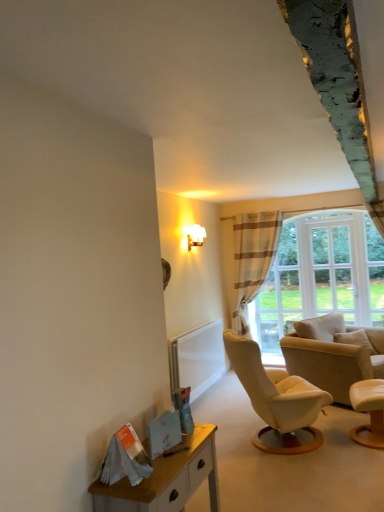
Find the location of `beige leather chair at right, arranged as the 2th chair when viewed from the front`. beige leather chair at right, arranged as the 2th chair when viewed from the front is located at coordinates (334, 354).

Locate an element on the screen. white frosted glass wall sconce at upper center is located at coordinates (195, 236).

What do you see at coordinates (166, 479) in the screenshot?
I see `wooden desk at lower left` at bounding box center [166, 479].

What are the coordinates of `beige leather chair at right, arranged as the 2th chair when viewed from the front` in the screenshot? It's located at (334, 354).

In terms of width, does wooden desk at lower left look wider or thinner when compared to striped fabric curtain at center?

Clearly, wooden desk at lower left has less width compared to striped fabric curtain at center.

Is wooden desk at lower left smaller than striped fabric curtain at center?

Yes.

In the scene shown: Is striped fabric curtain at center at the back of wooden desk at lower left?

No.

Is wooden desk at lower left next to striped fabric curtain at center?

wooden desk at lower left and striped fabric curtain at center are clearly separated.

Which object is closer to the camera, striped fabric curtain at center or wooden desk at lower left?

wooden desk at lower left is closer to the camera.

Between point (258, 272) and point (194, 459), which one is positioned behind?

Point (258, 272)

Do you think striped fabric curtain at center is within wooden desk at lower left, or outside of it?

striped fabric curtain at center lies outside wooden desk at lower left.

Can you tell me how much striped fabric curtain at center and wooden desk at lower left differ in facing direction?

89.7 degrees separate the facing orientations of striped fabric curtain at center and wooden desk at lower left.

Where is `lamp above the smooth beige armchair at lower right, placed as the 2th chair when sorted from back to front (from a real-world perspective)`? This screenshot has height=512, width=384. lamp above the smooth beige armchair at lower right, placed as the 2th chair when sorted from back to front (from a real-world perspective) is located at coordinates (195, 236).

From the image's perspective, is white frosted glass wall sconce at upper center under smooth beige armchair at lower right, placed as the 2th chair when sorted from back to front?

Actually, white frosted glass wall sconce at upper center appears above smooth beige armchair at lower right, placed as the 2th chair when sorted from back to front, in the image.

From a real-world perspective, is white frosted glass wall sconce at upper center over smooth beige armchair at lower right, placed as the 2th chair when sorted from back to front?

Yes, from a real-world perspective, white frosted glass wall sconce at upper center is above smooth beige armchair at lower right, placed as the 2th chair when sorted from back to front.

Is white glass window at upper right wider than beige leather chair at right, the first chair in the back-to-front sequence?

No, white glass window at upper right is not wider than beige leather chair at right, the first chair in the back-to-front sequence.

Is white glass window at upper right bigger than beige leather chair at right, arranged as the 2th chair when viewed from the front?

Actually, white glass window at upper right might be smaller than beige leather chair at right, arranged as the 2th chair when viewed from the front.

From the image's perspective, is white glass window at upper right below beige leather chair at right, arranged as the 2th chair when viewed from the front?

Incorrect, from the image's perspective, white glass window at upper right is higher than beige leather chair at right, arranged as the 2th chair when viewed from the front.

Is white glass window at upper right closer to camera compared to beige leather chair at right, the first chair in the back-to-front sequence?

No, white glass window at upper right is behind beige leather chair at right, the first chair in the back-to-front sequence.

Who is taller, wooden desk at lower left or beige leather chair at right, arranged as the 2th chair when viewed from the front?

Standing taller between the two is beige leather chair at right, arranged as the 2th chair when viewed from the front.

Can we say wooden desk at lower left lies outside beige leather chair at right, arranged as the 2th chair when viewed from the front?

Yes, wooden desk at lower left is located beyond the bounds of beige leather chair at right, arranged as the 2th chair when viewed from the front.

From the wooden desk at lower left, count 2nd chairs backward and point to it. Please provide its 2D coordinates.

[(334, 354)]

Does wooden desk at lower left have a lesser width compared to beige leather chair at right, the first chair in the back-to-front sequence?

Yes.

Considering the points (311, 255) and (253, 280), which point is behind, point (311, 255) or point (253, 280)?

Positioned behind is point (253, 280).

Does white glass window at upper right touch striped fabric curtain at center?

No, white glass window at upper right is not next to striped fabric curtain at center.

This screenshot has width=384, height=512. I want to click on window frame located above the striped fabric curtain at center (from a real-world perspective), so click(333, 269).

Looking at this image, considering the positions of objects white textured radiator at lower center and white glass window at upper right in the image provided, who is more to the right, white textured radiator at lower center or white glass window at upper right?

white glass window at upper right is more to the right.

Which of these two, white textured radiator at lower center or white glass window at upper right, is smaller?

white glass window at upper right.

Is white textured radiator at lower center far from white glass window at upper right?

white textured radiator at lower center is far away from white glass window at upper right.

The width and height of the screenshot is (384, 512). Identify the location of curtain on the right of wooden desk at lower left. (252, 259).

Locate an element on the screen. curtain above the wooden desk at lower left (from the image's perspective) is located at coordinates (252, 259).

Estimate the real-world distances between objects in this image. Which object is further from striped fabric curtain at center, wooden desk at lower left or white frosted glass wall sconce at upper center?

Among the two, wooden desk at lower left is located further to striped fabric curtain at center.

Looking at the image, which one is located closer to striped fabric curtain at center, beige leather chair at right, the first chair in the back-to-front sequence, or white glass window at upper right?

white glass window at upper right is positioned closer to the anchor striped fabric curtain at center.

In the scene shown: From the image, which object appears to be farther from white glass window at upper right, smooth beige armchair at lower right, placed as the 2th chair when sorted from back to front, or wooden desk at lower left?

Based on the image, wooden desk at lower left appears to be further to white glass window at upper right.

Estimate the real-world distances between objects in this image. Which object is further from smooth beige armchair at lower right, placed as the 2th chair when sorted from back to front, striped fabric curtain at center or beige leather chair at right, the first chair in the back-to-front sequence?

striped fabric curtain at center.

When comparing their distances from white frosted glass wall sconce at upper center, does white glass window at upper right or smooth beige armchair at lower right, which is counted as the first chair, starting from the front, seem further?

smooth beige armchair at lower right, which is counted as the first chair, starting from the front, lies further to white frosted glass wall sconce at upper center than the other object.

Looking at the image, which one is located closer to beige leather chair at right, arranged as the 2th chair when viewed from the front, white glass window at upper right or white textured radiator at lower center?

white glass window at upper right.

Based on their spatial positions, is striped fabric curtain at center or white textured radiator at lower center closer to smooth beige armchair at lower right, placed as the 2th chair when sorted from back to front?

The object closer to smooth beige armchair at lower right, placed as the 2th chair when sorted from back to front, is white textured radiator at lower center.

Considering their positions, is beige leather chair at right, arranged as the 2th chair when viewed from the front, positioned further to white glass window at upper right than white textured radiator at lower center?

Based on the image, white textured radiator at lower center appears to be further to white glass window at upper right.

Locate an element on the screen. radiator located between wooden desk at lower left and striped fabric curtain at center in the depth direction is located at coordinates (197, 359).

I want to click on radiator between smooth beige armchair at lower right, placed as the 2th chair when sorted from back to front, and white glass window at upper right from front to back, so click(x=197, y=359).

Where is `lamp located between smooth beige armchair at lower right, placed as the 2th chair when sorted from back to front, and striped fabric curtain at center in the depth direction`? The height and width of the screenshot is (512, 384). lamp located between smooth beige armchair at lower right, placed as the 2th chair when sorted from back to front, and striped fabric curtain at center in the depth direction is located at coordinates (195, 236).

Where is `radiator between smooth beige armchair at lower right, which is counted as the first chair, starting from the front, and striped fabric curtain at center in the front-back direction`? This screenshot has height=512, width=384. radiator between smooth beige armchair at lower right, which is counted as the first chair, starting from the front, and striped fabric curtain at center in the front-back direction is located at coordinates (197, 359).